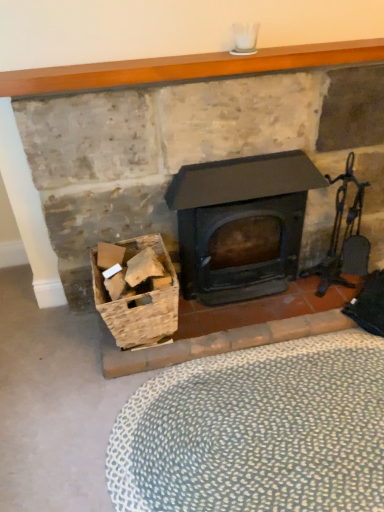
Question: In terms of height, does white dotted rug at lower center look taller or shorter compared to matte black wood burning stove at center?

Choices:
 (A) short
 (B) tall

Answer: (A)

Question: Is point (221, 375) closer or farther from the camera than point (253, 289)?

Choices:
 (A) closer
 (B) farther

Answer: (A)

Question: Which object is the farthest from the matte black stove at center?

Choices:
 (A) white dotted rug at lower center
 (B) smooth wooden mantle at upper center
 (C) matte black wood burning stove at center
 (D) metallic dark brown fireplace tool set at right
 (E) wooden crate at lower left

Answer: (A)

Question: Which is nearer to the white dotted rug at lower center?

Choices:
 (A) smooth wooden mantle at upper center
 (B) metallic dark brown fireplace tool set at right
 (C) matte black stove at center
 (D) wooden crate at lower left
 (E) matte black wood burning stove at center

Answer: (D)